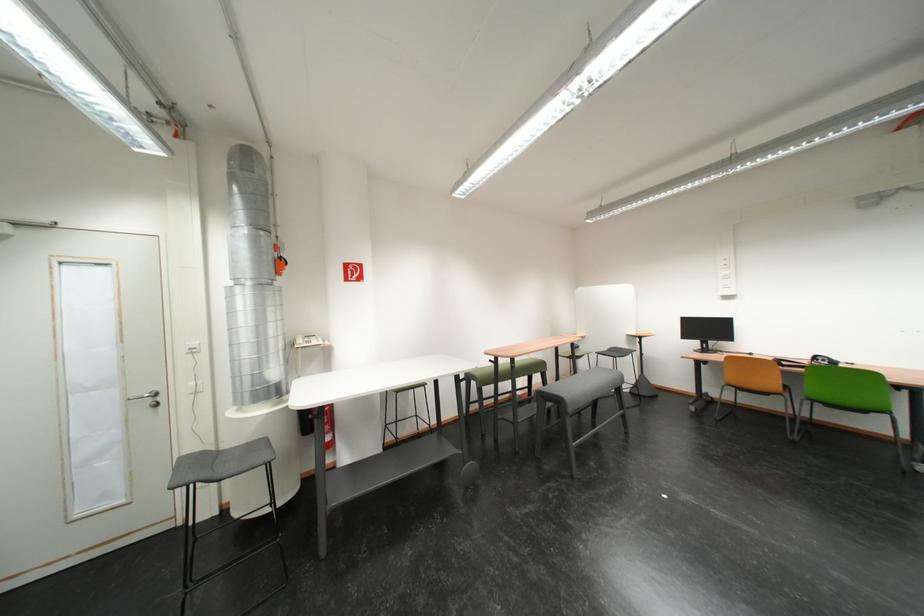
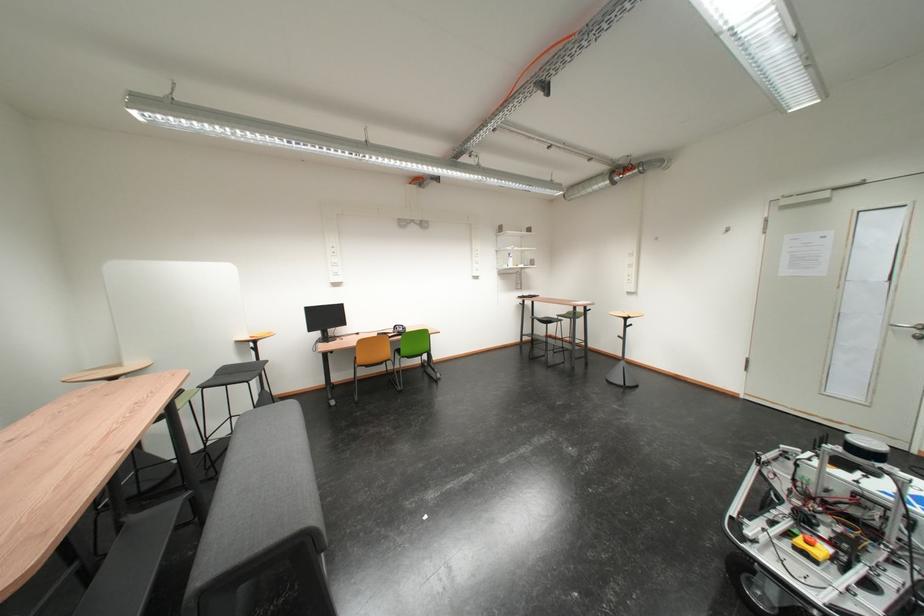
Where in the second image is the point corresponding to point 635,347 from the first image?

(246, 361)